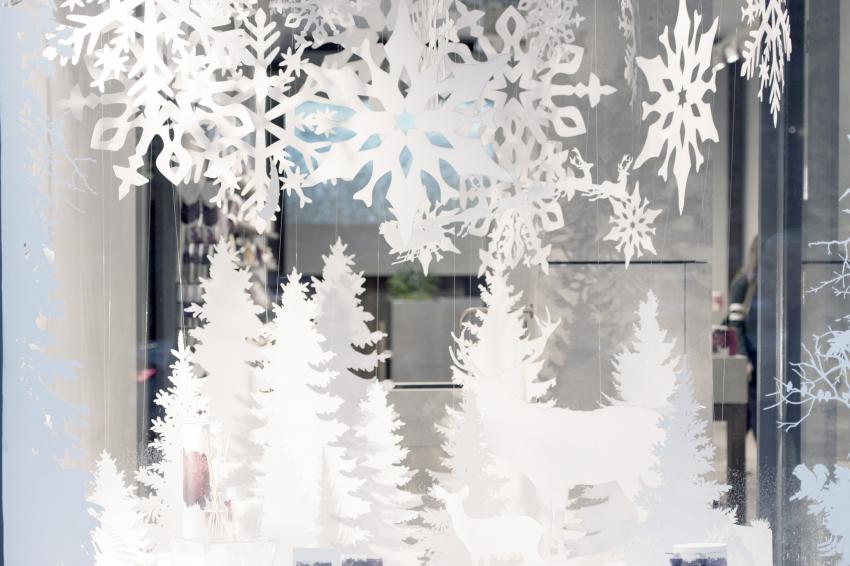
The height and width of the screenshot is (566, 850). I want to click on display table, so click(733, 374).